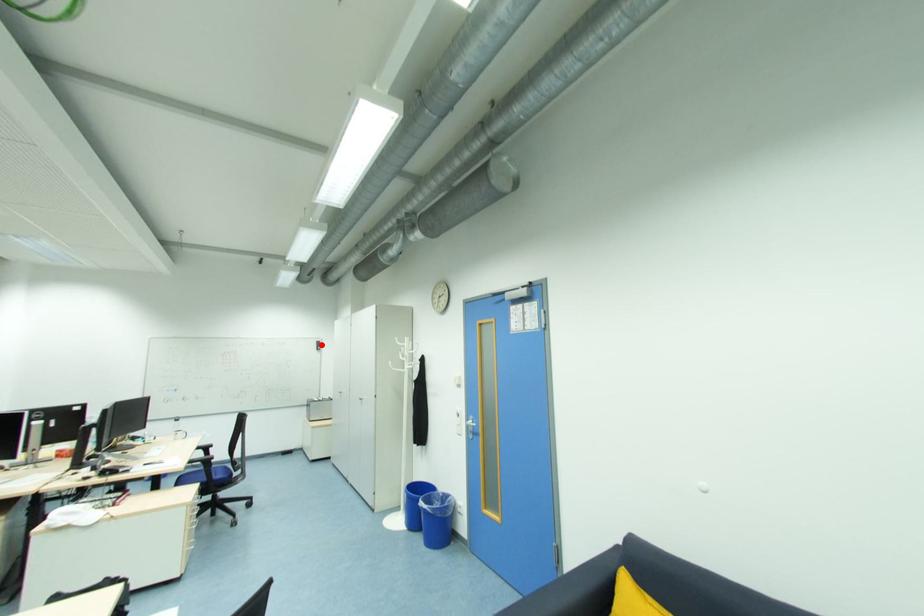
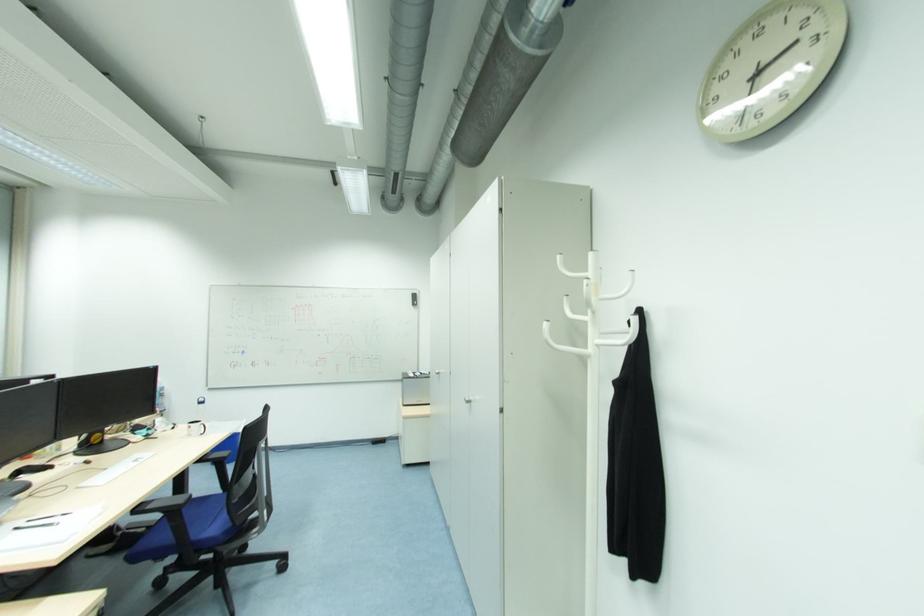
Find the pixel in the second image that matches the highlighted location in the first image.

(417, 298)